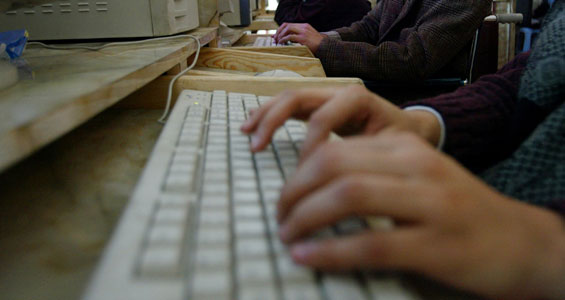
This screenshot has height=300, width=565. In order to click on mouse in this screenshot , I will do `click(282, 71)`.